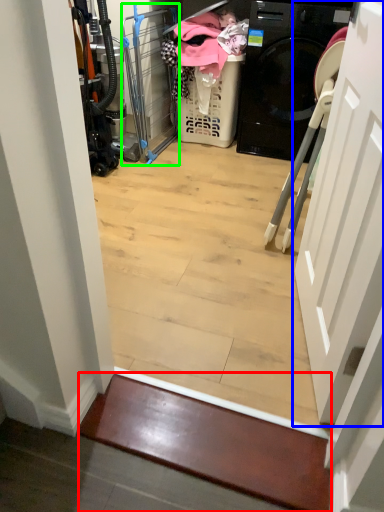
Question: Estimate the real-world distances between objects in this image. Which object is farther from stairwell (highlighted by a red box), door (highlighted by a blue box) or screen door (highlighted by a green box)?

Choices:
 (A) door
 (B) screen door

Answer: (B)